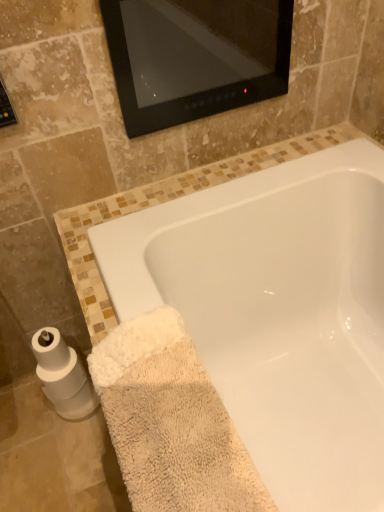
Question: Would you say beige fluffy towel at lower left is inside or outside white matte toilet paper at lower left?

Choices:
 (A) outside
 (B) inside

Answer: (A)

Question: In terms of size, does beige fluffy towel at lower left appear bigger or smaller than white matte toilet paper at lower left?

Choices:
 (A) big
 (B) small

Answer: (A)

Question: Which object is the closest to the beige fluffy towel at lower left?

Choices:
 (A) white matte toilet paper at lower left
 (B) white glossy bathtub at lower center

Answer: (B)

Question: Which object is the farthest from the beige fluffy towel at lower left?

Choices:
 (A) white matte toilet paper at lower left
 (B) white glossy bathtub at lower center

Answer: (A)